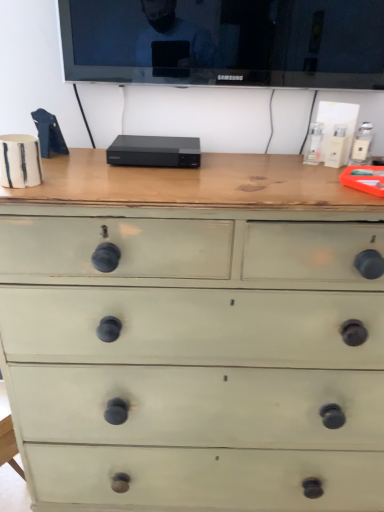
Locate an element on the screen. black glossy tv at upper center is located at coordinates (227, 41).

This screenshot has height=512, width=384. Describe the element at coordinates (227, 41) in the screenshot. I see `black glossy tv at upper center` at that location.

Measure the distance between black glossy tv at upper center and camera.

black glossy tv at upper center and camera are 1.08 meters apart.

Describe the element at coordinates (195, 335) in the screenshot. I see `green painted wood chest of drawers at center` at that location.

This screenshot has height=512, width=384. I want to click on green painted wood chest of drawers at center, so click(x=195, y=335).

Where is `black glossy tv at upper center`? black glossy tv at upper center is located at coordinates (227, 41).

Between green painted wood chest of drawers at center and black glossy tv at upper center, which one appears on the left side from the viewer's perspective?

From the viewer's perspective, green painted wood chest of drawers at center appears more on the left side.

In the scene shown: Which object is further away from the camera, green painted wood chest of drawers at center or black glossy tv at upper center?

black glossy tv at upper center.

Is point (361, 277) positioned before point (368, 28)?

Yes, point (361, 277) is closer to viewer.

From the image's perspective, between green painted wood chest of drawers at center and black glossy tv at upper center, who is located below?

green painted wood chest of drawers at center.

From a real-world perspective, is green painted wood chest of drawers at center under black glossy tv at upper center?

Yes, from a real-world perspective, green painted wood chest of drawers at center is under black glossy tv at upper center.

Does green painted wood chest of drawers at center have a lesser width compared to black glossy tv at upper center?

No.

Which of these two, green painted wood chest of drawers at center or black glossy tv at upper center, stands shorter?

black glossy tv at upper center.

Looking at the image, does green painted wood chest of drawers at center seem bigger or smaller compared to black glossy tv at upper center?

Clearly, green painted wood chest of drawers at center is larger in size than black glossy tv at upper center.

Is black glossy tv at upper center a part of green painted wood chest of drawers at center?

No, black glossy tv at upper center is not inside green painted wood chest of drawers at center.

Does green painted wood chest of drawers at center touch black glossy tv at upper center?

They are not placed beside each other.

Is green painted wood chest of drawers at center aimed at black glossy tv at upper center?

No, green painted wood chest of drawers at center is not oriented towards black glossy tv at upper center.

Where is `chest of drawers in front of the black glossy tv at upper center`? This screenshot has width=384, height=512. chest of drawers in front of the black glossy tv at upper center is located at coordinates (195, 335).

Does black glossy tv at upper center appear on the right side of green painted wood chest of drawers at center?

Yes.

Between black glossy tv at upper center and green painted wood chest of drawers at center, which one is positioned behind?

black glossy tv at upper center is more distant.

Is point (327, 69) in front of point (215, 458)?

Yes.

From the image's perspective, which is above, black glossy tv at upper center or green painted wood chest of drawers at center?

black glossy tv at upper center appears higher in the image.

From the picture: From a real-world perspective, is black glossy tv at upper center positioned over green painted wood chest of drawers at center based on gravity?

Yes, from a real-world perspective, black glossy tv at upper center is over green painted wood chest of drawers at center

Does black glossy tv at upper center have a greater width compared to green painted wood chest of drawers at center?

No.

Considering the sizes of objects black glossy tv at upper center and green painted wood chest of drawers at center in the image provided, who is taller, black glossy tv at upper center or green painted wood chest of drawers at center?

With more height is green painted wood chest of drawers at center.

Can you confirm if black glossy tv at upper center is smaller than green painted wood chest of drawers at center?

Yes.

Is green painted wood chest of drawers at center completely or partially inside black glossy tv at upper center?

No, green painted wood chest of drawers at center is located outside of black glossy tv at upper center.

Does black glossy tv at upper center touch green painted wood chest of drawers at center?

No, black glossy tv at upper center is not in contact with green painted wood chest of drawers at center.

Is black glossy tv at upper center turned away from green painted wood chest of drawers at center?

No.

Can you tell me how much black glossy tv at upper center and green painted wood chest of drawers at center differ in facing direction?

They differ by 0.445 degrees in their facing directions.

You are a GUI agent. You are given a task and a screenshot of the screen. Output one action in this format:
    pyautogui.click(x=<x>, y=<y>)
    Task: Click on the chest of drawers located below the black glossy tv at upper center (from the image's perspective)
    
    Given the screenshot: What is the action you would take?
    pyautogui.click(x=195, y=335)

The image size is (384, 512). Find the location of `the chest of drawers below the black glossy tv at upper center (from a real-world perspective)`. the chest of drawers below the black glossy tv at upper center (from a real-world perspective) is located at coordinates (195, 335).

Locate an element on the screen. Image resolution: width=384 pixels, height=512 pixels. television on the right of green painted wood chest of drawers at center is located at coordinates pyautogui.click(x=227, y=41).